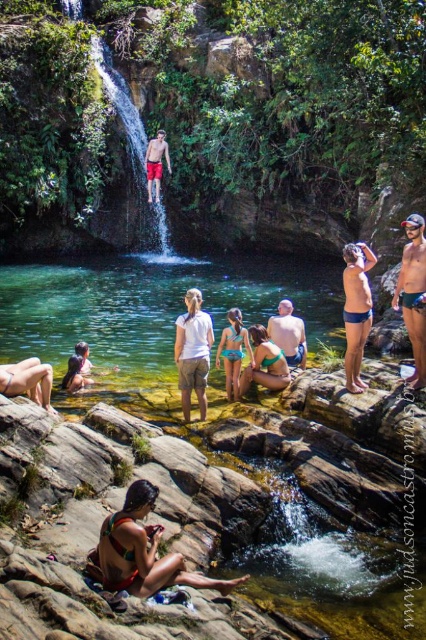
Question: Observing the image, what is the correct spatial positioning of matte green bikini at center in reference to matte skin leg at lower left?

Choices:
 (A) left
 (B) right

Answer: (B)

Question: Based on their relative distances, which object is farther from the blue fabric swimsuit at center?

Choices:
 (A) matte blue shorts at right
 (B) white cotton shirt at center
 (C) matte white bikini at lower left
 (D) matte green bikini at center

Answer: (A)

Question: Which object is the closest to the matte blue shorts at right?

Choices:
 (A) smooth skin man at center
 (B) white cotton shirt at center
 (C) matte green bikini at center
 (D) matte skin leg at lower left

Answer: (C)

Question: Can you confirm if matte skin leg at lower left is bigger than blue fabric swimsuit at center?

Choices:
 (A) yes
 (B) no

Answer: (A)

Question: Can you confirm if multicolored bikini at lower left is wider than matte skin leg at lower left?

Choices:
 (A) yes
 (B) no

Answer: (A)

Question: Considering the real-world distances, which object is closest to the matte skin leg at lower left?

Choices:
 (A) blue matte shorts at center
 (B) blue fabric swimsuit at center
 (C) matte green bikini at center

Answer: (B)